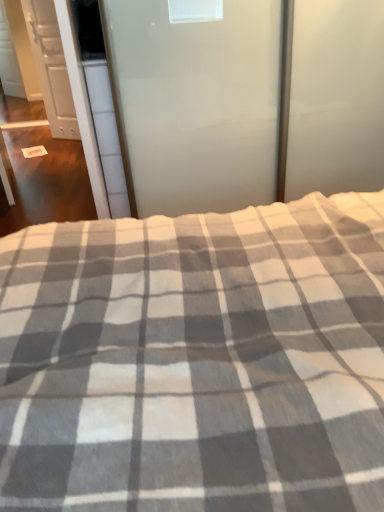
Question: Considering the relative sizes of frosted glass screen door at upper center, which ranks as the second screen door in back-to-front order, and white matte cabinet at left in the image provided, is frosted glass screen door at upper center, which ranks as the second screen door in back-to-front order, taller than white matte cabinet at left?

Choices:
 (A) no
 (B) yes

Answer: (A)

Question: Does frosted glass screen door at upper center, the first screen door from the front, have a smaller size compared to white matte cabinet at left?

Choices:
 (A) no
 (B) yes

Answer: (A)

Question: Does frosted glass screen door at upper center, which ranks as the second screen door in back-to-front order, turn towards white matte cabinet at left?

Choices:
 (A) no
 (B) yes

Answer: (A)

Question: Considering the relative positions of frosted glass screen door at upper center, the first screen door from the right, and white matte cabinet at left in the image provided, is frosted glass screen door at upper center, the first screen door from the right, to the right of white matte cabinet at left from the viewer's perspective?

Choices:
 (A) no
 (B) yes

Answer: (B)

Question: Is frosted glass screen door at upper center, the first screen door from the right, to the left of white matte cabinet at left from the viewer's perspective?

Choices:
 (A) yes
 (B) no

Answer: (B)

Question: Visually, is frosted glass screen door at upper center, the second screen door from the left, positioned to the left or to the right of white glossy door at upper left, the 2th screen door viewed from the front?

Choices:
 (A) right
 (B) left

Answer: (A)

Question: From a real-world perspective, is frosted glass screen door at upper center, the first screen door from the right, above or below white glossy door at upper left, which is the 1th screen door from left to right?

Choices:
 (A) above
 (B) below

Answer: (B)

Question: Considering the positions of frosted glass screen door at upper center, the first screen door from the front, and white glossy door at upper left, the first screen door from the back, in the image, is frosted glass screen door at upper center, the first screen door from the front, wider or thinner than white glossy door at upper left, the first screen door from the back,?

Choices:
 (A) wide
 (B) thin

Answer: (A)

Question: From their relative heights in the image, would you say frosted glass screen door at upper center, which ranks as the second screen door in back-to-front order, is taller or shorter than white glossy door at upper left, the first screen door from the back?

Choices:
 (A) short
 (B) tall

Answer: (A)

Question: Is gray checkered blanket at center in front of or behind frosted glass screen door at upper center, which ranks as the second screen door in back-to-front order, in the image?

Choices:
 (A) front
 (B) behind

Answer: (A)

Question: From the image's perspective, is gray checkered blanket at center located above or below frosted glass screen door at upper center, the first screen door from the front?

Choices:
 (A) below
 (B) above

Answer: (A)

Question: Based on their sizes in the image, would you say gray checkered blanket at center is bigger or smaller than frosted glass screen door at upper center, the first screen door from the right?

Choices:
 (A) big
 (B) small

Answer: (A)

Question: From a real-world perspective, is gray checkered blanket at center positioned above or below frosted glass screen door at upper center, the first screen door from the right?

Choices:
 (A) above
 (B) below

Answer: (A)

Question: In terms of width, does white glossy door at upper left, which is the 1th screen door from left to right, look wider or thinner when compared to white matte cabinet at left?

Choices:
 (A) thin
 (B) wide

Answer: (B)

Question: Would you say white glossy door at upper left, acting as the second screen door starting from the right, is to the left or to the right of white matte cabinet at left in the picture?

Choices:
 (A) left
 (B) right

Answer: (B)